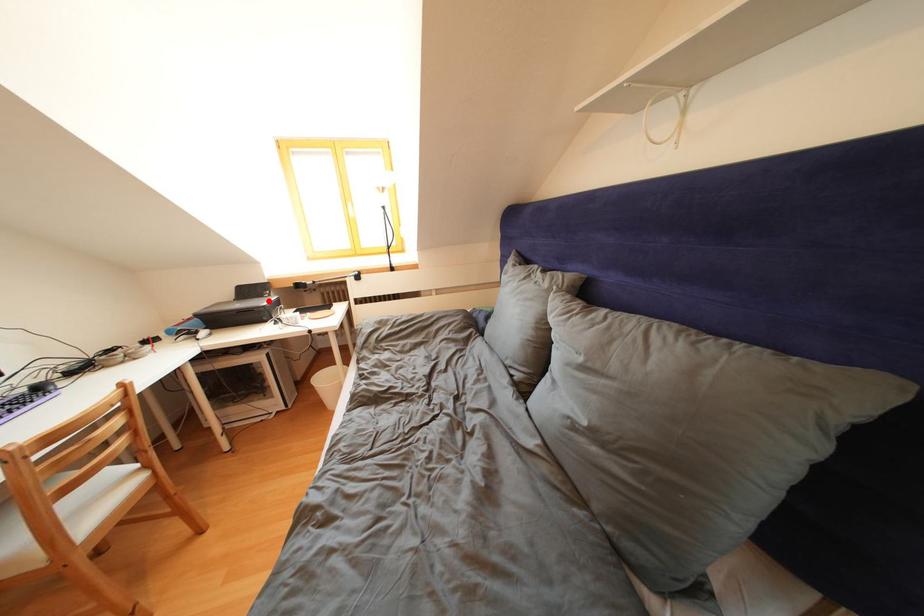
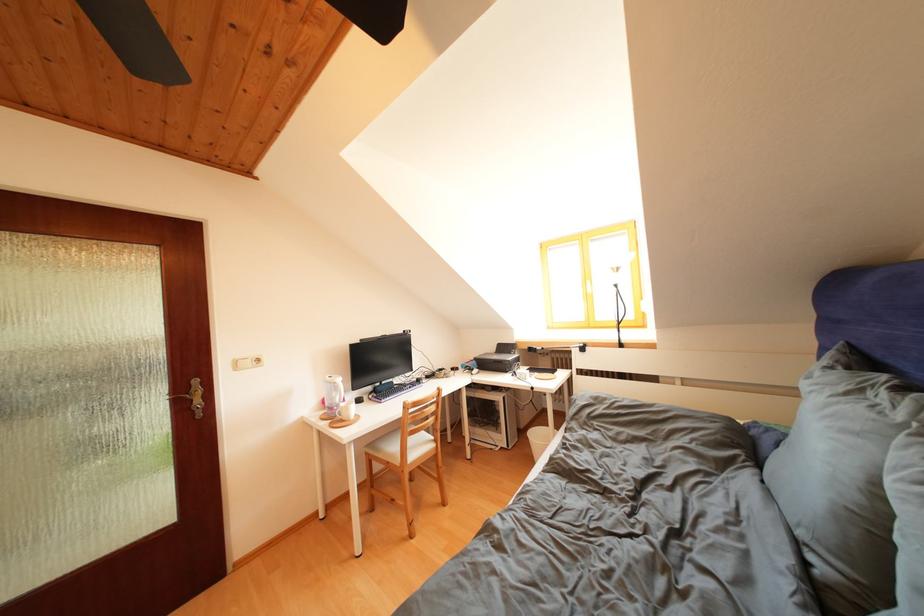
Question: I am providing you with two images of the same scene from different viewpoints. Given a red point in image1, look at the same physical point in image2. Is it:

Choices:
 (A) Closer to the viewpoint
 (B) Farther from the viewpoint

Answer: (B)